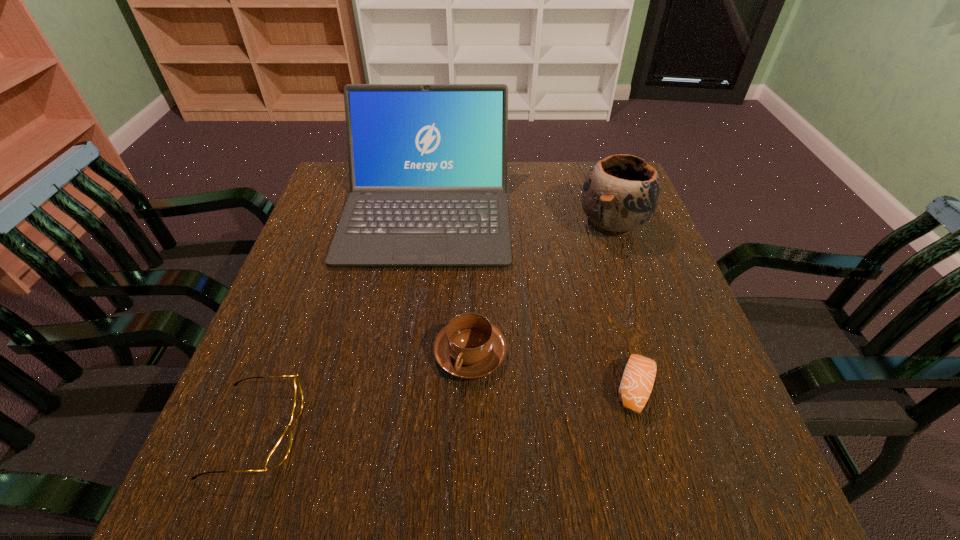
Locate an element on the screen. The height and width of the screenshot is (540, 960). empty space that is in between the cappuccino and the second tallest object is located at coordinates (541, 288).

You are a GUI agent. You are given a task and a screenshot of the screen. Output one action in this format:
    pyautogui.click(x=<x>, y=<y>)
    Task: Click on the free space between the tallest object and the sushi
    
    Given the screenshot: What is the action you would take?
    pyautogui.click(x=531, y=300)

I want to click on vacant point located between the spectacles and the laptop computer, so pyautogui.click(x=342, y=321).

Where is `vacant area between the laptop computer and the pottery`? vacant area between the laptop computer and the pottery is located at coordinates (519, 218).

Identify the location of the second closest object to the cappuccino. The width and height of the screenshot is (960, 540). (638, 378).

The height and width of the screenshot is (540, 960). I want to click on object that is the fourth closest to the laptop computer, so click(278, 454).

Identify the location of free space that satisfies the following two spatial constraints: 1. on the screen of the tallest object; 2. on the right side of the sushi. The height and width of the screenshot is (540, 960). (401, 388).

Identify the location of blank area in the image that satisfies the following two spatial constraints: 1. on the side of the third shortest object with the handle; 2. on the right side of the sushi. This screenshot has height=540, width=960. (469, 388).

At what (x,y) coordinates should I click in order to perform the action: click on vacant area that satisfies the following two spatial constraints: 1. on the screen of the laptop computer; 2. on the left side of the pottery. Please return your answer as a coordinate pair (x, y). The image size is (960, 540). Looking at the image, I should click on (x=425, y=223).

The image size is (960, 540). I want to click on vacant area that satisfies the following two spatial constraints: 1. on the back side of the second tallest object; 2. on the left side of the sushi, so click(588, 223).